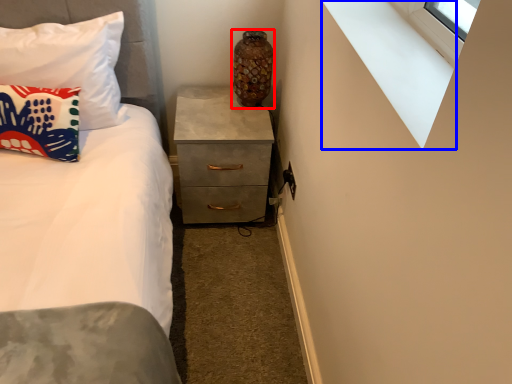
Question: Which object appears closest to the camera in this image, vase (highlighted by a red box) or window sill (highlighted by a blue box)?

Choices:
 (A) vase
 (B) window sill

Answer: (B)